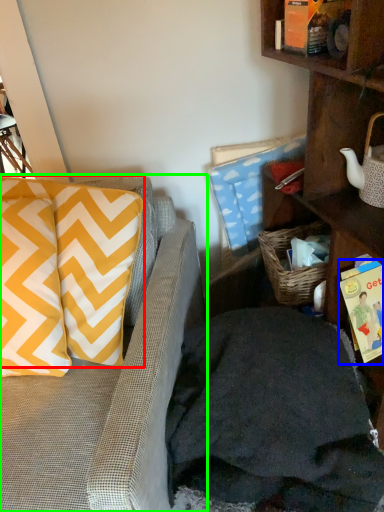
Question: Which is nearer to the pillow (highlighted by a red box)? book (highlighted by a blue box) or studio couch (highlighted by a green box).

Choices:
 (A) book
 (B) studio couch

Answer: (B)